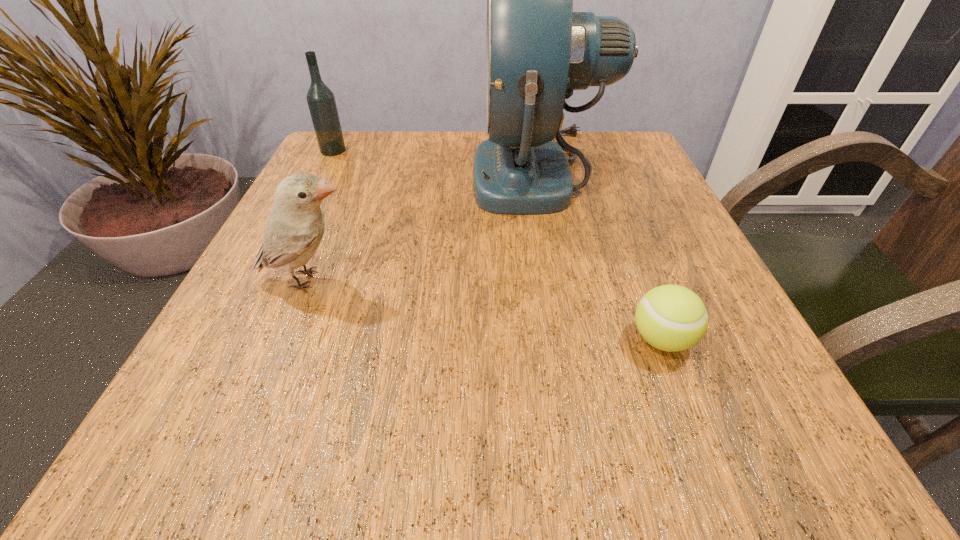
Where is `free point that satisfies the following two spatial constraints: 1. at the face of the bird; 2. on the back side of the nearest object`? free point that satisfies the following two spatial constraints: 1. at the face of the bird; 2. on the back side of the nearest object is located at coordinates (284, 340).